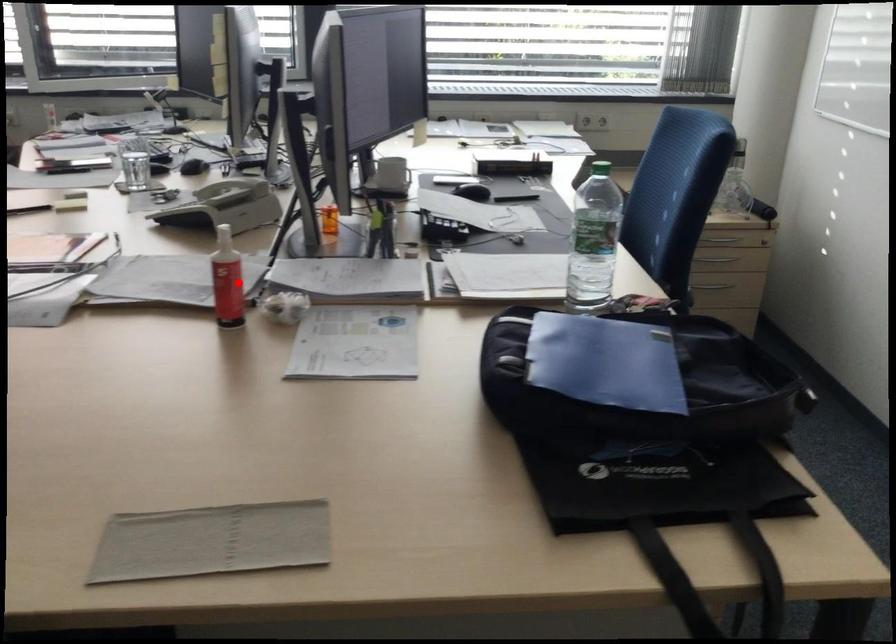
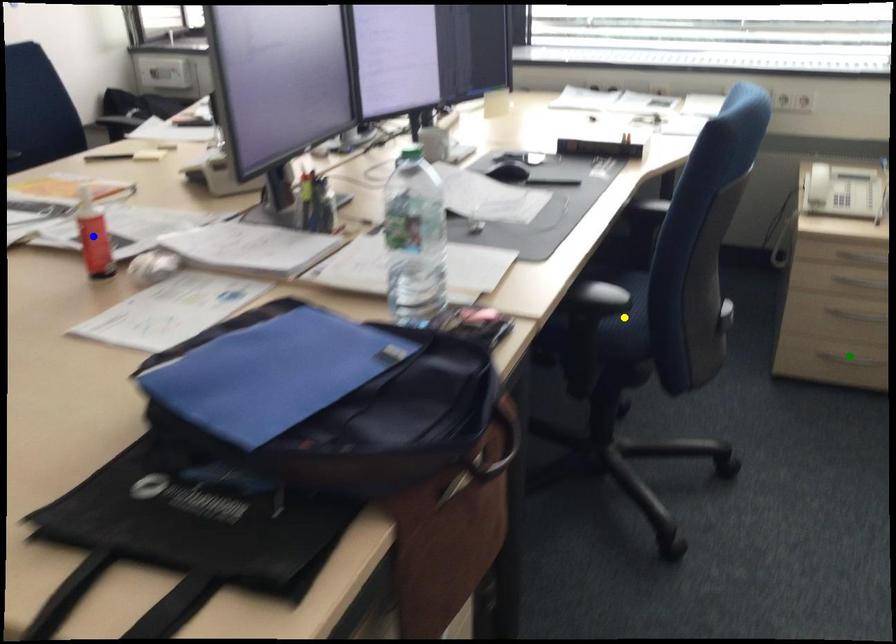
Question: I am providing you with two images of the same scene from different viewpoints. A red point is marked on the first image. You are given multiple points on the second image. Which spot in image 2 lines up with the point in image 1?

Choices:
 (A) green point
 (B) blue point
 (C) yellow point

Answer: (B)